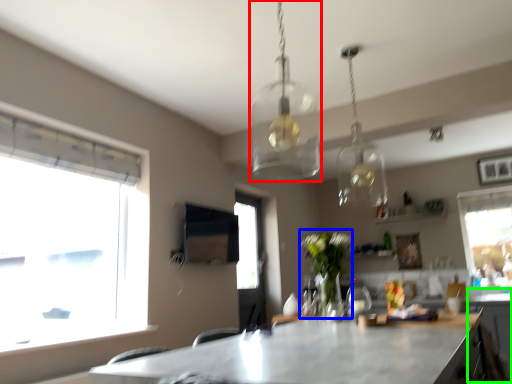
Question: Based on their relative distances, which object is nearer to lamp (highlighted by a red box)? Choose from plant (highlighted by a blue box) and cabinetry (highlighted by a green box).

Choices:
 (A) plant
 (B) cabinetry

Answer: (A)